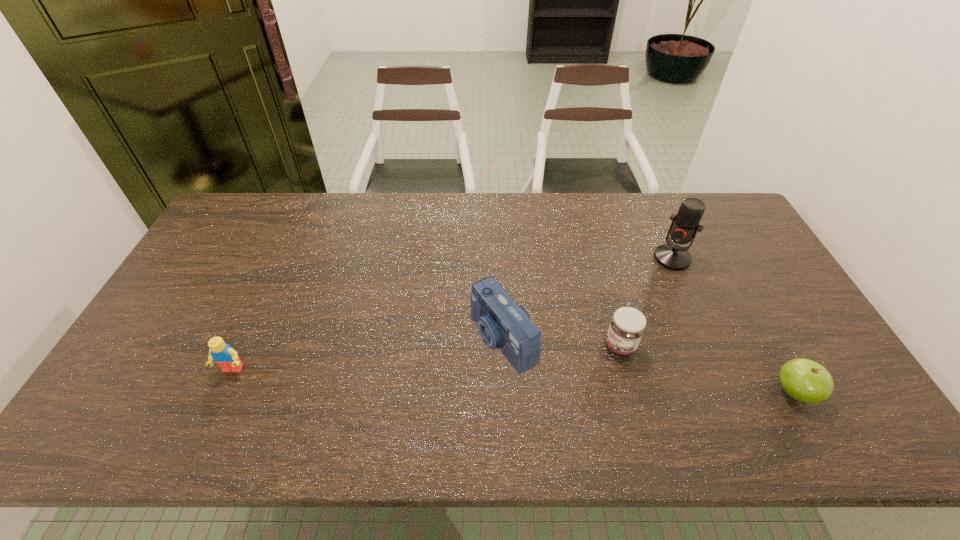
Identify the location of free spot on the desktop that is between the leftmost object and the rightmost object and is positioned on the side of the farthest object with the red ring. The height and width of the screenshot is (540, 960). (571, 383).

The width and height of the screenshot is (960, 540). Find the location of `vacant space on the desktop that is between the leftmost object and the rightmost object and is positioned on the front label of the jam`. vacant space on the desktop that is between the leftmost object and the rightmost object and is positioned on the front label of the jam is located at coordinates (552, 382).

Find the location of a particular element. vacant spot on the desktop that is between the leftmost object and the rightmost object and is positioned on the lens of the camera is located at coordinates (426, 377).